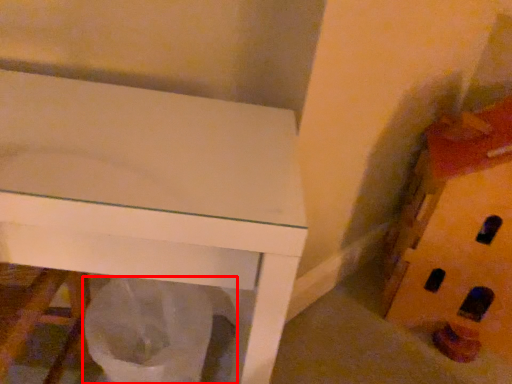
Question: From the image's perspective, what is the correct spatial relationship of garbage (annotated by the red box) in relation to toy?

Choices:
 (A) above
 (B) below

Answer: (B)